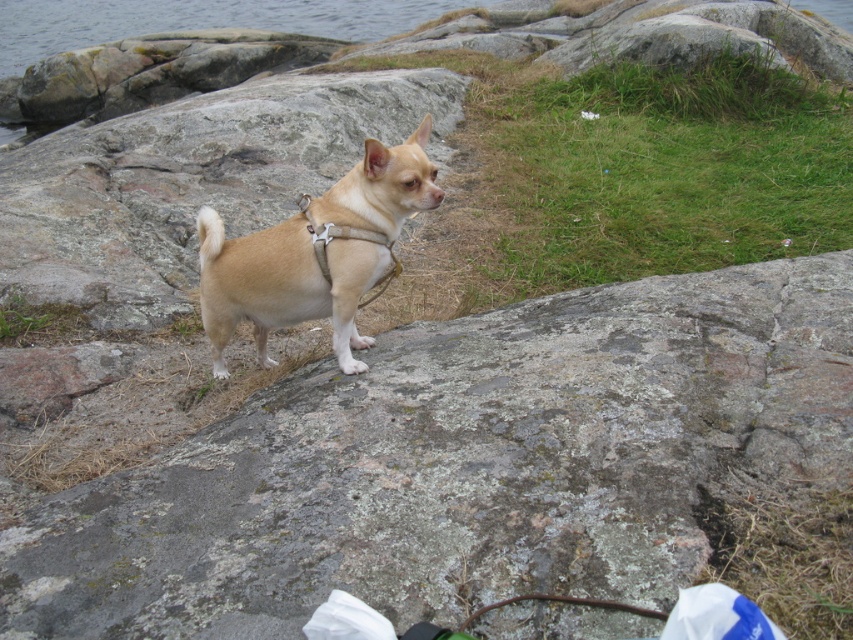
Measure the distance from smooth gray rock at center to tan matte harness at center.

They are 20.02 inches apart.

Does point (157, 528) come closer to viewer compared to point (363, 204)?

Yes, point (157, 528) is closer to viewer.

The height and width of the screenshot is (640, 853). I want to click on smooth gray rock at center, so click(463, 465).